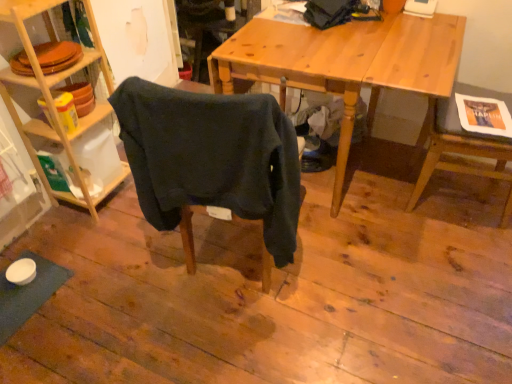
Find the location of `vacant space in front of wooden chair at right, placed as the second chair when sorted from left to right`. vacant space in front of wooden chair at right, placed as the second chair when sorted from left to right is located at coordinates tap(458, 255).